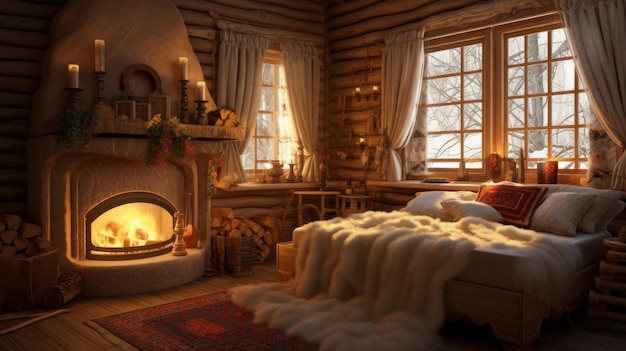
The image size is (626, 351). I want to click on rug, so click(x=231, y=327).